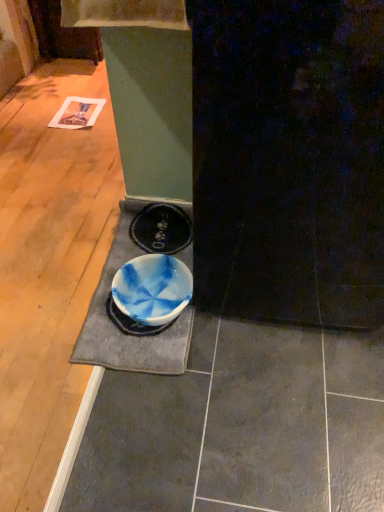
Find the location of a particular element. This screenshot has height=512, width=384. free space on the front side of blue marbled doormat at center is located at coordinates (154, 423).